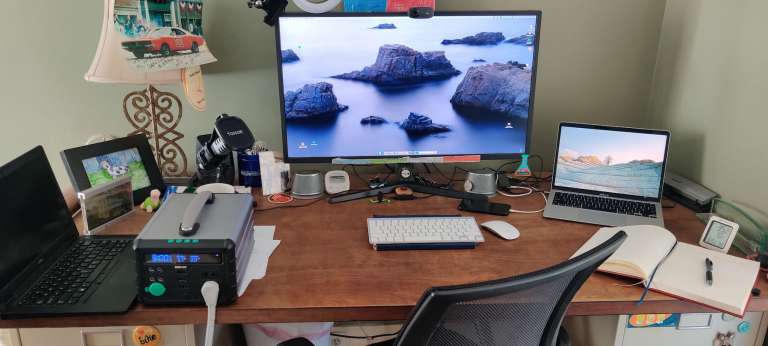
This screenshot has height=346, width=768. I want to click on monitor, so click(x=402, y=88).